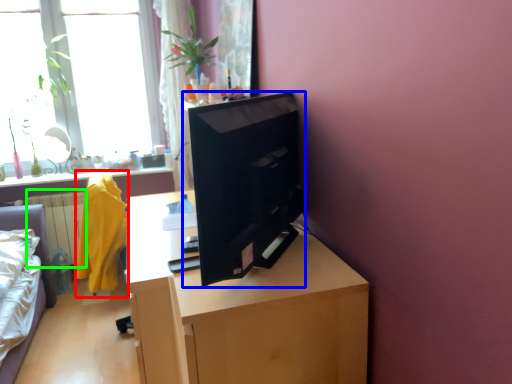
Question: Which object is positioned farthest from robe (highlighted by a red box)? Select from computer (highlighted by a blue box) and radiator (highlighted by a green box).

Choices:
 (A) computer
 (B) radiator

Answer: (A)